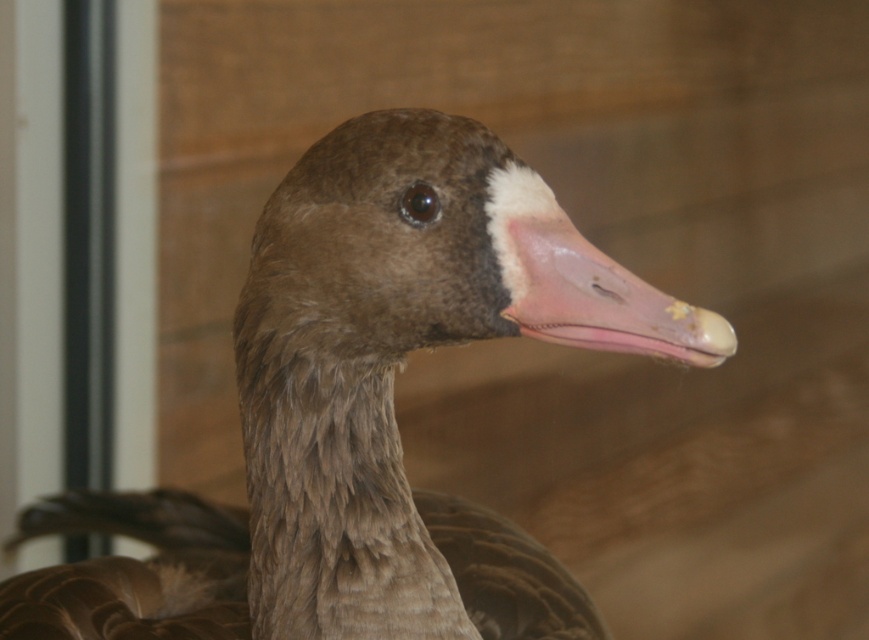
Question: Does brown feathered duck at center appear on the left side of pink matte beak at center?

Choices:
 (A) yes
 (B) no

Answer: (A)

Question: Which of the following is the closest to the observer?

Choices:
 (A) pink matte beak at center
 (B) brown feathered duck at center

Answer: (A)

Question: Which of the following is the farthest from the observer?

Choices:
 (A) brown feathered duck at center
 (B) pink matte beak at center

Answer: (A)

Question: From the image, what is the correct spatial relationship of brown feathered duck at center in relation to pink matte beak at center?

Choices:
 (A) above
 (B) below

Answer: (B)

Question: Does brown feathered duck at center come behind pink matte beak at center?

Choices:
 (A) yes
 (B) no

Answer: (A)